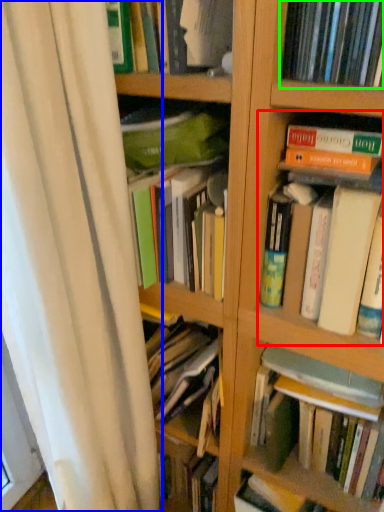
Question: Estimate the real-world distances between objects in this image. Which object is closer to book (highlighted by a red box), shower curtain (highlighted by a blue box) or book (highlighted by a green box)?

Choices:
 (A) shower curtain
 (B) book

Answer: (B)